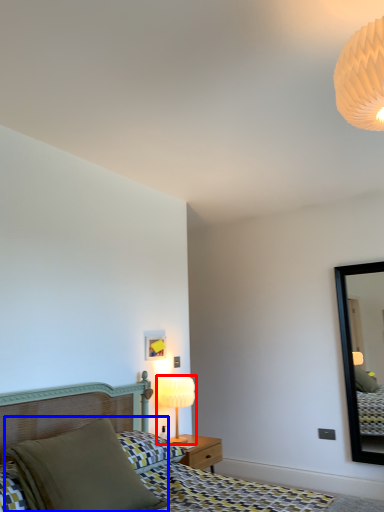
Question: Among these objects, which one is farthest to the camera, table lamp (highlighted by a red box) or pillow (highlighted by a blue box)?

Choices:
 (A) table lamp
 (B) pillow

Answer: (A)